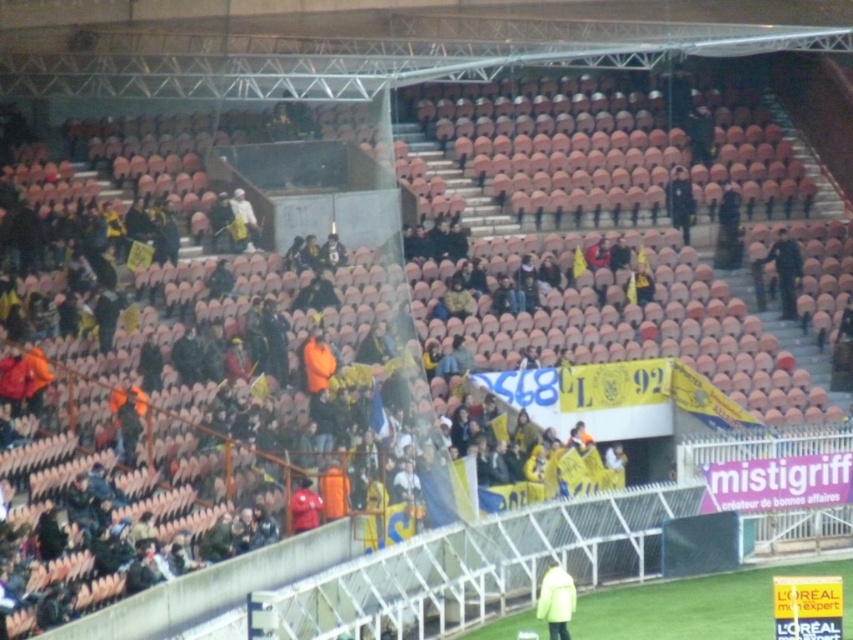
Does yellow matte jacket at center lie in front of black uniform at center?

Yes, it is in front of black uniform at center.

Is yellow matte jacket at center behind black uniform at center?

No, it is not.

Who is more forward, (546,593) or (782,307)?

Positioned in front is point (546,593).

Identify the location of yellow matte jacket at center. (556, 600).